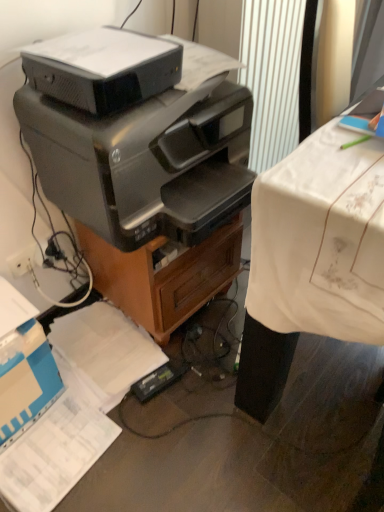
Question: Is black glossy printer at center, placed as the first printer when sorted from bottom to top, facing towards white cloth-covered desk at right?

Choices:
 (A) no
 (B) yes

Answer: (A)

Question: Is black glossy printer at center, the 2th printer viewed from the top, not near white cloth-covered desk at right?

Choices:
 (A) yes
 (B) no

Answer: (B)

Question: Is black glossy printer at center, the 2th printer viewed from the top, thinner than white cloth-covered desk at right?

Choices:
 (A) yes
 (B) no

Answer: (B)

Question: Can you confirm if black glossy printer at center, placed as the first printer when sorted from bottom to top, is positioned to the right of white cloth-covered desk at right?

Choices:
 (A) no
 (B) yes

Answer: (A)

Question: Can you confirm if black glossy printer at center, the 2th printer viewed from the top, is positioned to the left of white cloth-covered desk at right?

Choices:
 (A) no
 (B) yes

Answer: (B)

Question: From their relative heights in the image, would you say satin black printer at upper center, which ranks as the first printer in top-to-bottom order, is taller or shorter than white cloth-covered desk at right?

Choices:
 (A) short
 (B) tall

Answer: (A)

Question: From a real-world perspective, is satin black printer at upper center, which ranks as the first printer in top-to-bottom order, above or below white cloth-covered desk at right?

Choices:
 (A) below
 (B) above

Answer: (B)

Question: In the image, is satin black printer at upper center, acting as the 2th printer starting from the bottom, positioned in front of or behind white cloth-covered desk at right?

Choices:
 (A) behind
 (B) front

Answer: (A)

Question: Does point (46, 40) appear closer or farther from the camera than point (291, 262)?

Choices:
 (A) farther
 (B) closer

Answer: (A)

Question: From the image's perspective, is satin black printer at upper center, which ranks as the first printer in top-to-bottom order, above or below metallic brown file cabinet at center?

Choices:
 (A) below
 (B) above

Answer: (B)

Question: Considering the positions of satin black printer at upper center, acting as the 2th printer starting from the bottom, and metallic brown file cabinet at center in the image, is satin black printer at upper center, acting as the 2th printer starting from the bottom, bigger or smaller than metallic brown file cabinet at center?

Choices:
 (A) small
 (B) big

Answer: (A)

Question: Does point (110, 91) appear closer or farther from the camera than point (162, 342)?

Choices:
 (A) farther
 (B) closer

Answer: (B)

Question: Is satin black printer at upper center, acting as the 2th printer starting from the bottom, inside or outside of metallic brown file cabinet at center?

Choices:
 (A) outside
 (B) inside

Answer: (A)

Question: Considering their positions, is satin black printer at upper center, acting as the 2th printer starting from the bottom, located in front of or behind white plastic plug at lower left?

Choices:
 (A) front
 (B) behind

Answer: (A)

Question: Is satin black printer at upper center, acting as the 2th printer starting from the bottom, bigger or smaller than white plastic plug at lower left?

Choices:
 (A) small
 (B) big

Answer: (B)